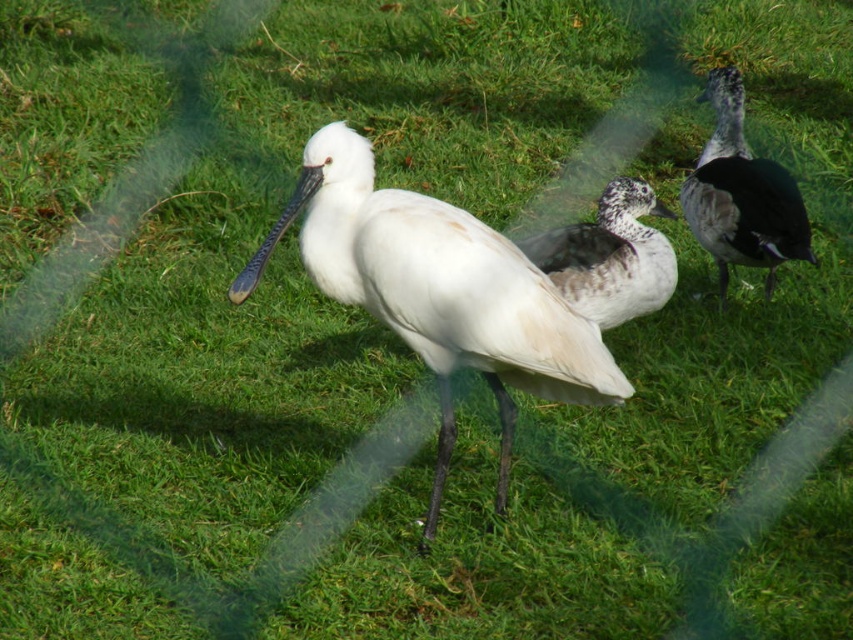
Question: Which object is positioned closest to the speckled white duck at center?

Choices:
 (A) white matte bird at center
 (B) speckled gray duck at right

Answer: (A)

Question: Does white matte bird at center come behind speckled gray duck at right?

Choices:
 (A) no
 (B) yes

Answer: (A)

Question: Which object is farther from the camera taking this photo?

Choices:
 (A) white matte bird at center
 (B) speckled gray duck at right
 (C) speckled white duck at center

Answer: (B)

Question: Which object is closer to the camera taking this photo?

Choices:
 (A) speckled gray duck at right
 (B) speckled white duck at center

Answer: (B)

Question: Can you confirm if speckled gray duck at right is positioned above speckled white duck at center?

Choices:
 (A) yes
 (B) no

Answer: (A)

Question: From the image, what is the correct spatial relationship of white matte bird at center in relation to speckled white duck at center?

Choices:
 (A) above
 (B) below

Answer: (B)